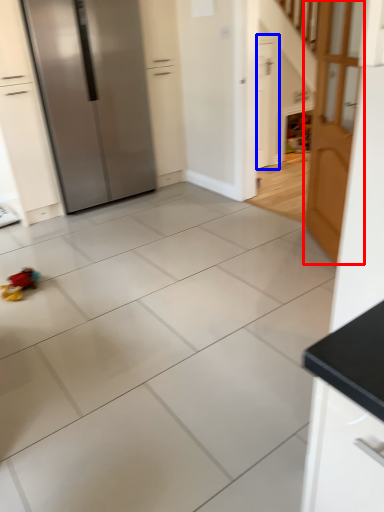
Question: Which object appears closest to the camera in this image, door (highlighted by a red box) or door (highlighted by a blue box)?

Choices:
 (A) door
 (B) door

Answer: (A)